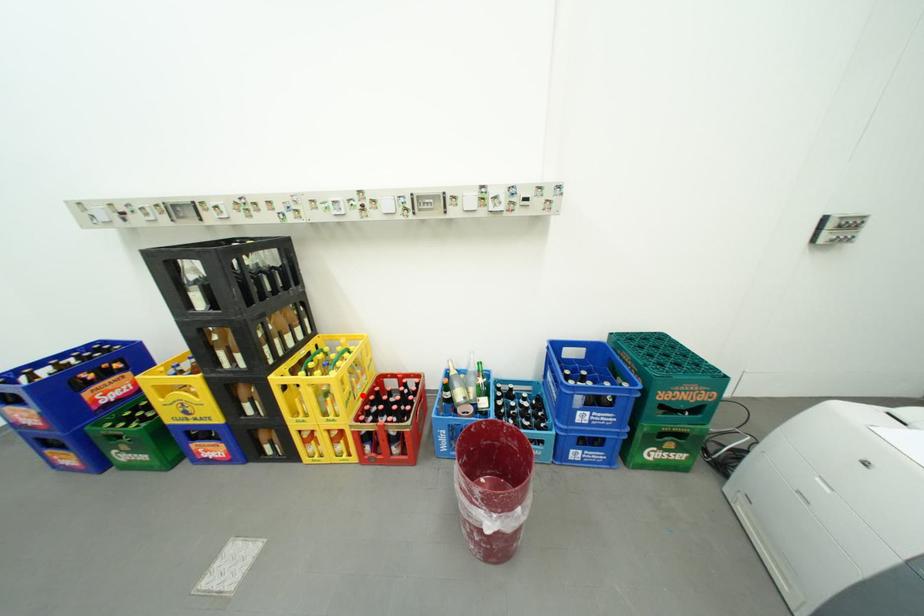
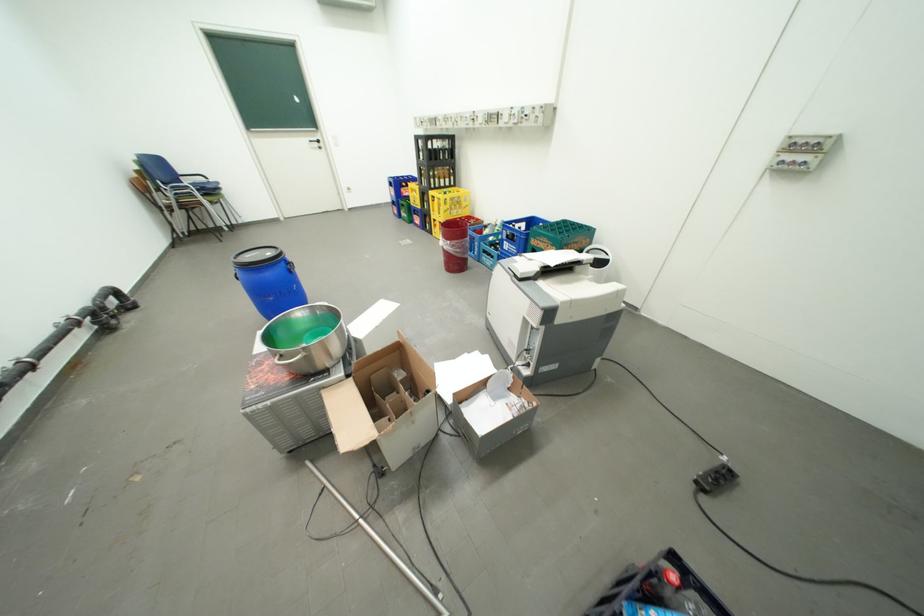
Locate, in the second image, the point that corresponds to the highlighted location in the first image.

(459, 212)